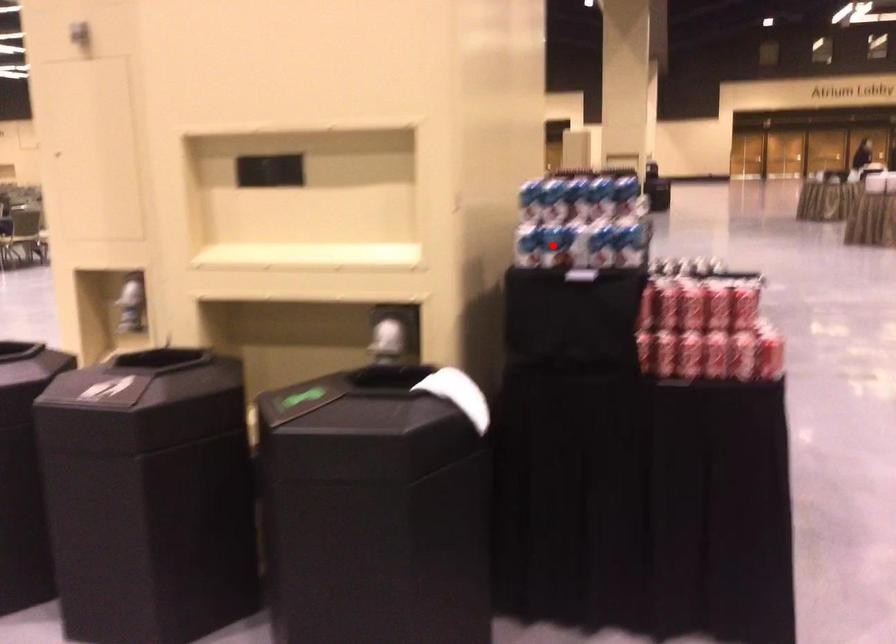
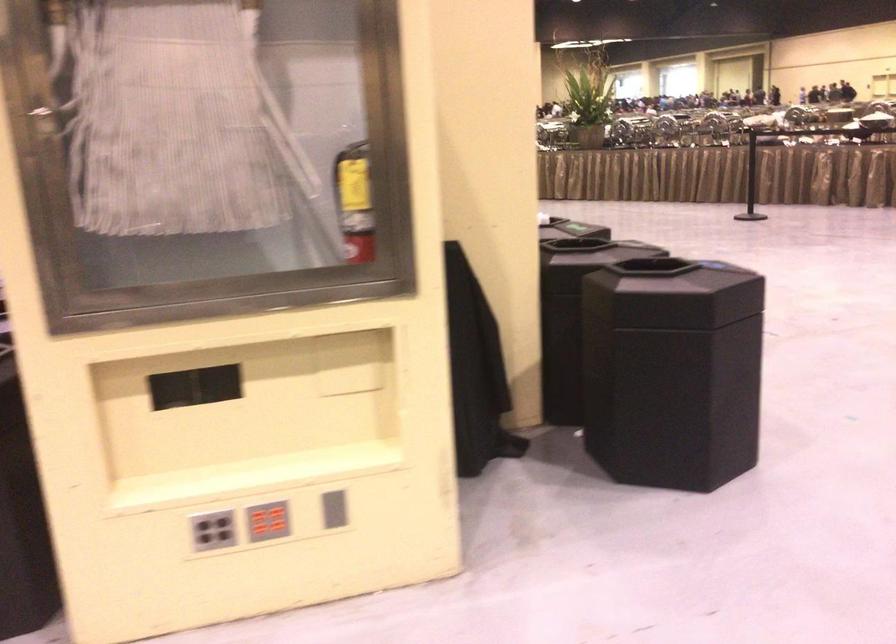
Question: I am providing you with two images of the same scene from different viewpoints. A red point is marked on the first image. At the location where the point appears in image 1, is it still visible in image 2?

Choices:
 (A) Yes
 (B) No

Answer: (B)